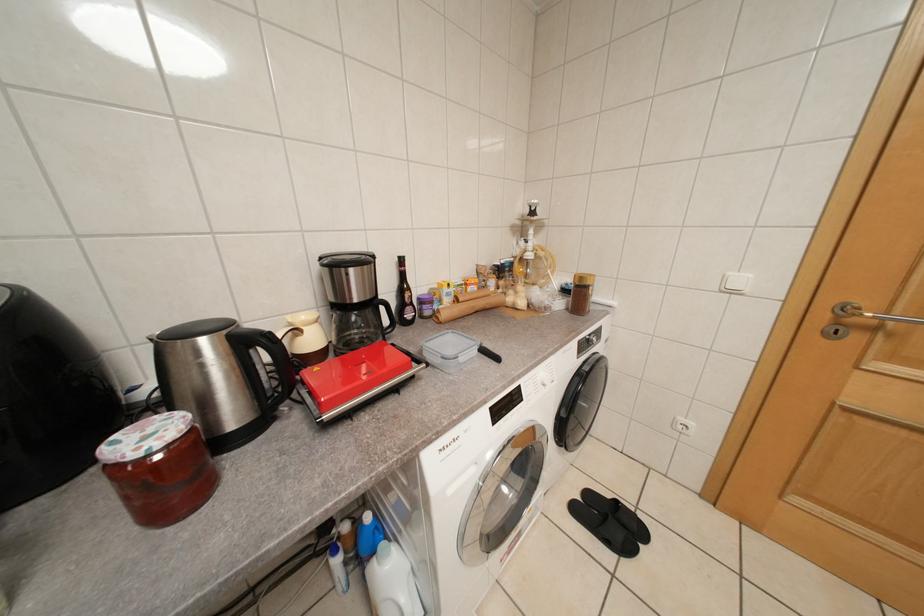
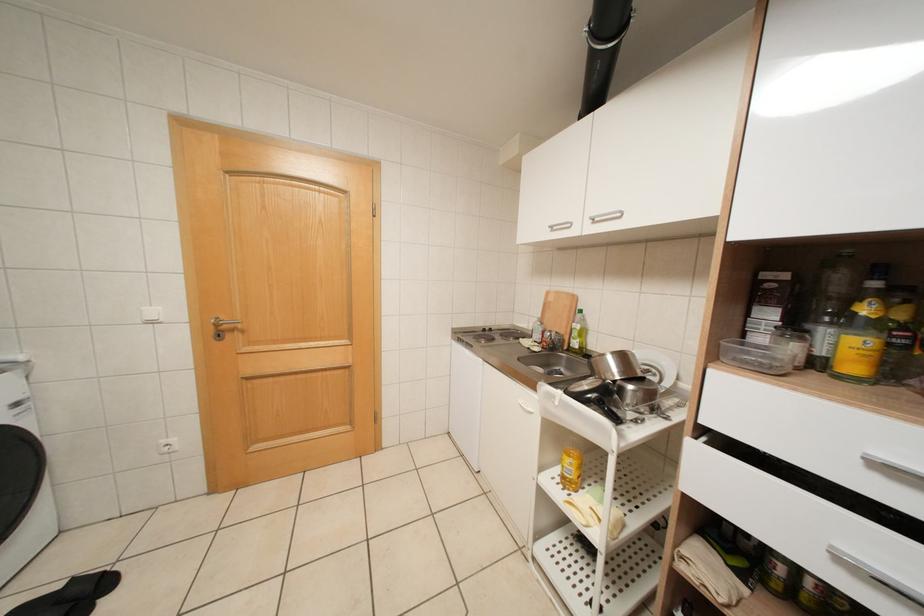
Question: The camera is either moving clockwise (left) or counter-clockwise (right) around the object. The first image is from the beginning of the video and the second image is from the end. Is the camera moving left or right when shooting the video?

Choices:
 (A) Left
 (B) Right

Answer: (A)